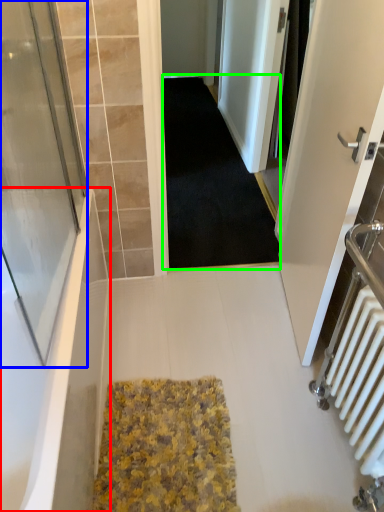
Question: Which is nearer to the bathtub (highlighted by a red box)? screen door (highlighted by a blue box) or doormat (highlighted by a green box).

Choices:
 (A) screen door
 (B) doormat

Answer: (A)